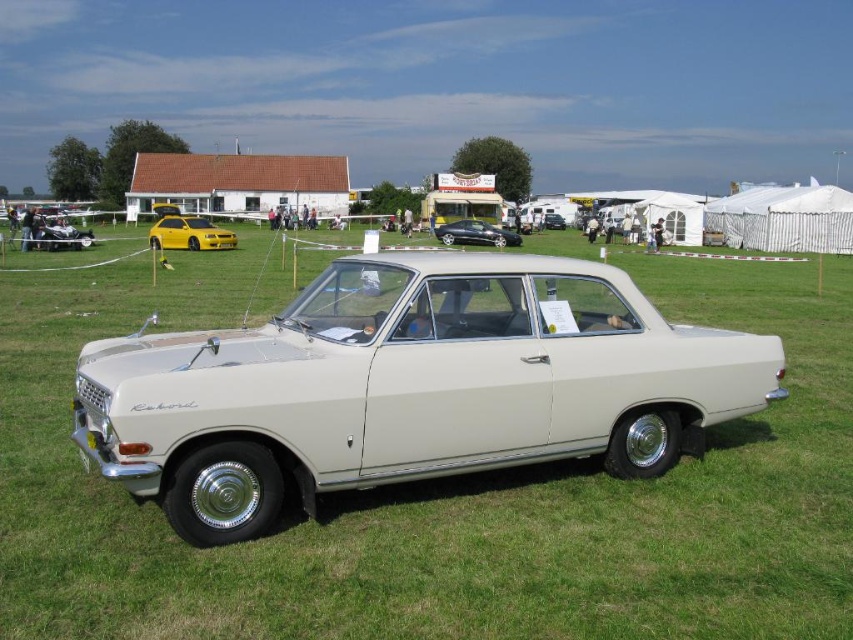
You are attending a car show and notice two sedans at the center of the image. The satin black sedan at center and the white glossy sedan at center. Which one is positioned lower in the image?

The satin black sedan at center is located below the white glossy sedan at center, so it is positioned lower in the image.

Consider the image. You are a photographer planning to take a photo of the satin black sedan at center and the white glossy sedan at center. Since you want to highlight their height differences, which sedan should you position closer to the camera to make it appear taller?

To emphasize the height difference, position the white glossy sedan at center closer to the camera because it is taller than the satin black sedan at center.